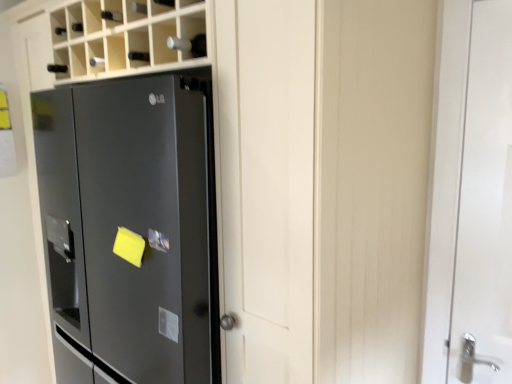
The image size is (512, 384). What do you see at coordinates (485, 207) in the screenshot?
I see `white glossy door at right` at bounding box center [485, 207].

Where is `white glossy door at right`? Image resolution: width=512 pixels, height=384 pixels. white glossy door at right is located at coordinates (485, 207).

You are a GUI agent. You are given a task and a screenshot of the screen. Output one action in this format:
    pyautogui.click(x=<x>, y=<y>)
    Task: Click on the satin black refrigerator at left
    The width and height of the screenshot is (512, 384).
    Given the screenshot: What is the action you would take?
    pyautogui.click(x=130, y=228)

Describe the element at coordinates (130, 228) in the screenshot. I see `satin black refrigerator at left` at that location.

Measure the distance between point (163, 258) and camera.

1.13 meters.

Where is `white glossy door at right`? Image resolution: width=512 pixels, height=384 pixels. white glossy door at right is located at coordinates (485, 207).

Based on the photo, which object is positioned more to the right, satin black refrigerator at left or white glossy door at right?

white glossy door at right is more to the right.

Which object is more forward, satin black refrigerator at left or white glossy door at right?

satin black refrigerator at left is in front.

Between point (208, 265) and point (490, 53), which one is positioned behind?

The point (490, 53) is farther from the camera.

From the image's perspective, which one is positioned lower, satin black refrigerator at left or white glossy door at right?

satin black refrigerator at left is shown below in the image.

From a real-world perspective, is satin black refrigerator at left positioned over white glossy door at right based on gravity?

No, from a real-world perspective, satin black refrigerator at left is not above white glossy door at right.

From the picture: Which object is wider, satin black refrigerator at left or white glossy door at right?

satin black refrigerator at left is wider.

Is satin black refrigerator at left shorter than white glossy door at right?

Incorrect, the height of satin black refrigerator at left does not fall short of that of white glossy door at right.

Considering the sizes of objects satin black refrigerator at left and white glossy door at right in the image provided, who is smaller, satin black refrigerator at left or white glossy door at right?

white glossy door at right.

Can white glossy door at right be found inside satin black refrigerator at left?

Definitely not — white glossy door at right is not inside satin black refrigerator at left.

Is satin black refrigerator at left far away from white glossy door at right?

Yes, satin black refrigerator at left is far from white glossy door at right.

Is satin black refrigerator at left oriented away from white glossy door at right?

No, satin black refrigerator at left's orientation is not away from white glossy door at right.

Can you tell me how much satin black refrigerator at left and white glossy door at right differ in facing direction?

2.12 degrees separate the facing orientations of satin black refrigerator at left and white glossy door at right.

The height and width of the screenshot is (384, 512). In order to click on refrigerator on the left of the white glossy door at right in this screenshot , I will do `click(130, 228)`.

Which is more to the left, white glossy door at right or satin black refrigerator at left?

Positioned to the left is satin black refrigerator at left.

Which object is closer to the camera taking this photo, white glossy door at right or satin black refrigerator at left?

Positioned in front is satin black refrigerator at left.

Considering the points (487, 355) and (206, 243), which point is behind, point (487, 355) or point (206, 243)?

Positioned behind is point (487, 355).

From the image's perspective, would you say white glossy door at right is positioned over satin black refrigerator at left?

Yes.

From a real-world perspective, is white glossy door at right positioned above or below satin black refrigerator at left?

Clearly, from a real-world perspective, white glossy door at right is above satin black refrigerator at left.

Is white glossy door at right wider or thinner than satin black refrigerator at left?

Considering their sizes, white glossy door at right looks slimmer than satin black refrigerator at left.

Considering the sizes of objects white glossy door at right and satin black refrigerator at left in the image provided, who is shorter, white glossy door at right or satin black refrigerator at left?

With less height is white glossy door at right.

Looking at the image, does white glossy door at right seem bigger or smaller compared to satin black refrigerator at left?

In the image, white glossy door at right appears to be smaller than satin black refrigerator at left.

Is white glossy door at right situated inside satin black refrigerator at left or outside?

white glossy door at right cannot be found inside satin black refrigerator at left.

Is white glossy door at right far away from satin black refrigerator at left?

white glossy door at right is far away from satin black refrigerator at left.

Is white glossy door at right facing towards satin black refrigerator at left?

No.

How many degrees apart are the facing directions of white glossy door at right and satin black refrigerator at left?

They differ by 2.12 degrees in their facing directions.

The image size is (512, 384). Find the location of `door above the satin black refrigerator at left (from a real-world perspective)`. door above the satin black refrigerator at left (from a real-world perspective) is located at coordinates coord(485,207).

The image size is (512, 384). Identify the location of door lying above the satin black refrigerator at left (from the image's perspective). (485, 207).

This screenshot has width=512, height=384. In the image, there is a white glossy door at right. Identify the location of refrigerator below it (from the image's perspective). (130, 228).